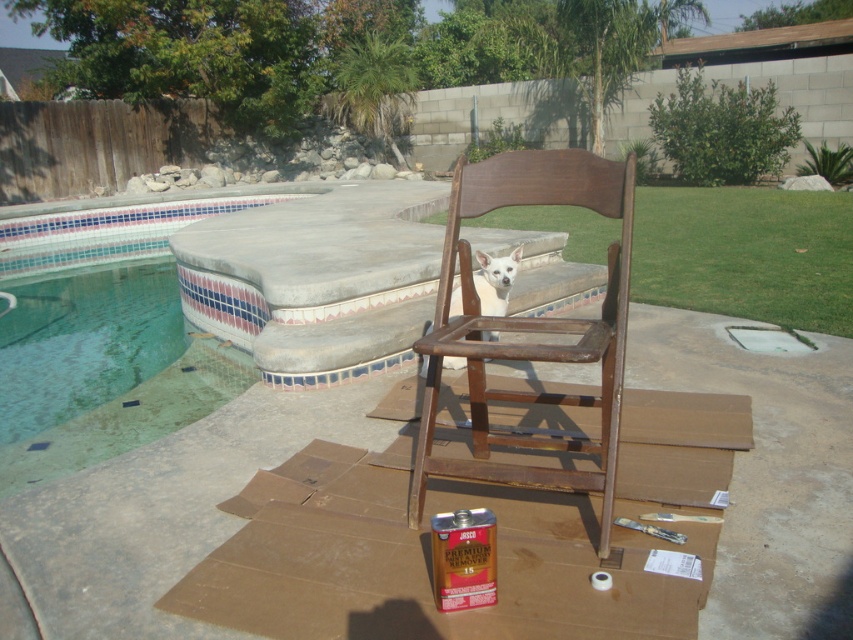
You are planning to place a 3ft wide bench on the deck. Given the green tile swimming pool at upper left and the white smooth dog at center, which object has a greater width to accommodate the bench?

The green tile swimming pool at upper left has a greater width than the white smooth dog at center, so the bench can be placed near the green tile swimming pool at upper left.

You are planning to place a small decorative pot that is 1 foot in diameter on the deck. Considering the rustic wood chair at center and the white smooth dog at center, which object would you need to move to make space for the pot?

The rustic wood chair at center is larger in size than the white smooth dog at center, so you would need to move the rustic wood chair at center to make space for the decorative pot.